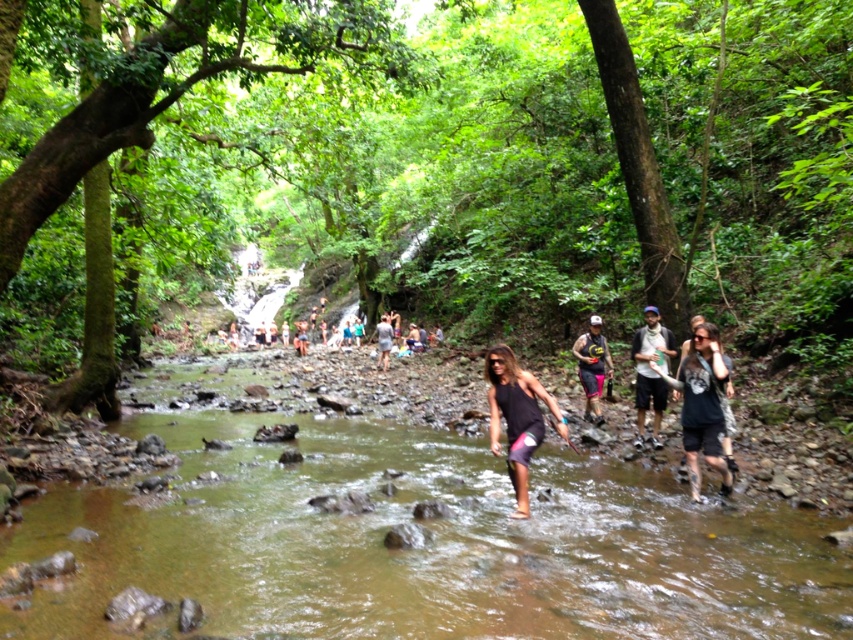
Question: Which object is closer to the camera taking this photo?

Choices:
 (A) clear water at center
 (B) matte gray shirt at center

Answer: (A)

Question: Is matte gray shirt at center positioned before light brown fabric shorts at center?

Choices:
 (A) no
 (B) yes

Answer: (B)

Question: Which point is farther to the camera?

Choices:
 (A) (660, 337)
 (B) (720, 364)

Answer: (A)

Question: Is clear water at center above black matte tank top at center?

Choices:
 (A) no
 (B) yes

Answer: (A)

Question: Which object appears closest to the camera in this image?

Choices:
 (A) black matte tank top at center
 (B) matte gray shirt at center
 (C) green leafy forest at center
 (D) black tank top at center

Answer: (A)

Question: Observing the image, what is the correct spatial positioning of black matte tank top at center in reference to light brown fabric shorts at center?

Choices:
 (A) left
 (B) right

Answer: (B)